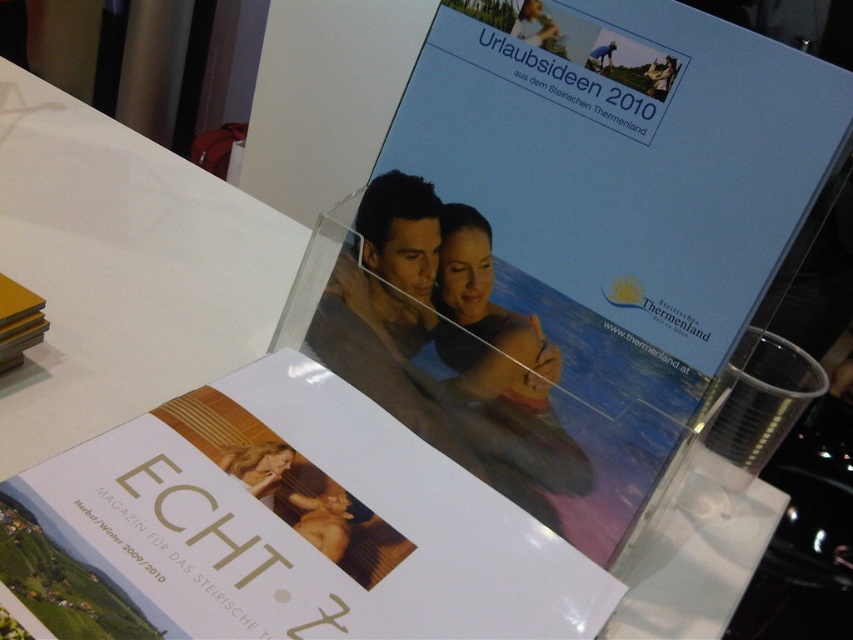
Measure the distance between white glossy book at center and camera.

11.13 inches

Can you confirm if white glossy book at center is wider than blonde hair at center?

Yes, white glossy book at center is wider than blonde hair at center.

Is point (473, 630) closer to viewer compared to point (262, 497)?

Yes, point (473, 630) is closer to viewer.

Find the location of a particular element. The image size is (853, 640). white glossy book at center is located at coordinates (282, 529).

Can you confirm if white paper at upper left is positioned above blonde hair at center?

Yes.

Is point (6, 236) positioned behind point (229, 465)?

Yes, point (6, 236) is behind point (229, 465).

Describe the element at coordinates (122, 269) in the screenshot. I see `white paper at upper left` at that location.

I want to click on white paper at upper left, so click(122, 269).

The width and height of the screenshot is (853, 640). What do you see at coordinates (282, 529) in the screenshot?
I see `white glossy book at center` at bounding box center [282, 529].

Is white glossy book at center bigger than yellow matte book at upper left?

Indeed, white glossy book at center has a larger size compared to yellow matte book at upper left.

Which is in front, point (215, 484) or point (13, 282)?

Point (215, 484) is in front.

This screenshot has width=853, height=640. I want to click on white glossy book at center, so click(282, 529).